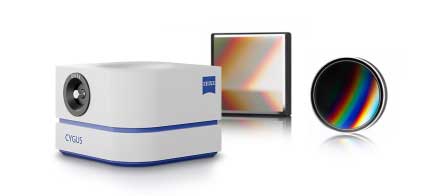
Identify the location of mirror. The width and height of the screenshot is (440, 196). (267, 71).